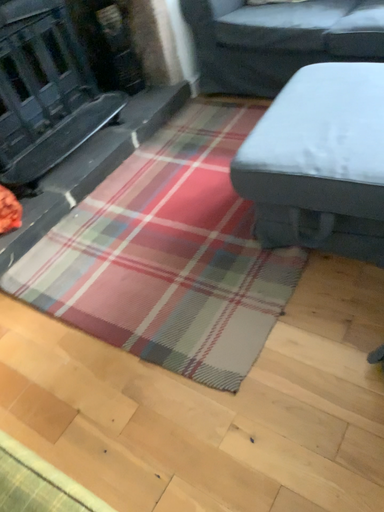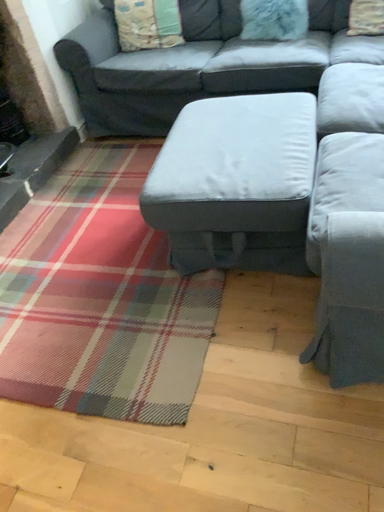
Question: Which way did the camera rotate in the video?

Choices:
 (A) rotated upward
 (B) rotated downward

Answer: (A)